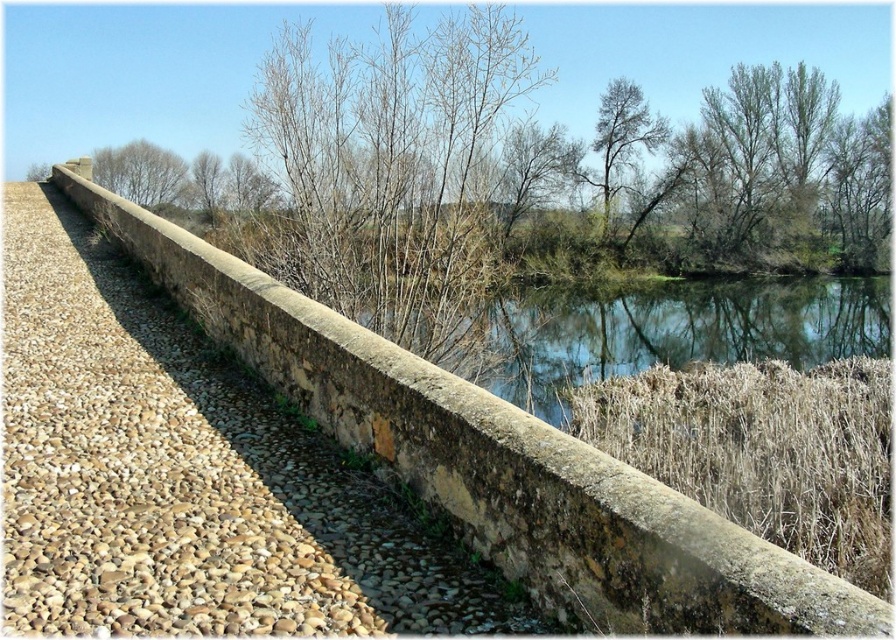
You are standing on the gravel path to the left of the stone wall and notice two trees in the distance. Which tree, the brown leafless tree at upper center or the brown wood tree at upper left, is closer to you?

The brown leafless tree at upper center is closer to you because it is positioned in front of the brown wood tree at upper left.

You are an artist sketching the scene and want to ensure the proportions of the trees are accurate. Which tree has a wider spread, the brown leafless tree at upper center or the brown wood tree at upper left?

The brown wood tree at upper left has a wider spread than the brown leafless tree at upper center.